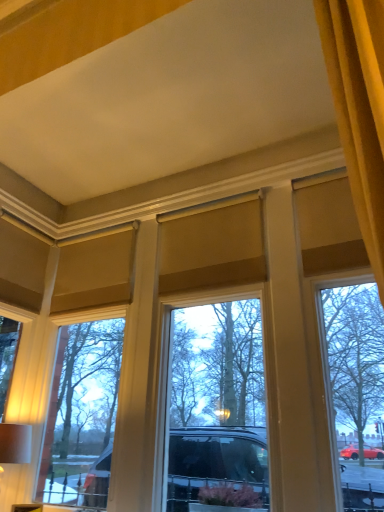
Question: From the image's perspective, is matte white table lamp at lower left located above or below matte glass window at center?

Choices:
 (A) below
 (B) above

Answer: (A)

Question: From a real-world perspective, is matte white table lamp at lower left above or below matte glass window at center?

Choices:
 (A) above
 (B) below

Answer: (B)

Question: In the image, is matte white table lamp at lower left positioned in front of or behind matte glass window at center?

Choices:
 (A) front
 (B) behind

Answer: (B)

Question: Is point (137, 250) closer or farther from the camera than point (14, 458)?

Choices:
 (A) closer
 (B) farther

Answer: (B)

Question: Would you say matte glass window at center is to the left or to the right of matte white table lamp at lower left in the picture?

Choices:
 (A) left
 (B) right

Answer: (B)

Question: Considering the positions of matte glass window at center and matte white table lamp at lower left in the image, is matte glass window at center wider or thinner than matte white table lamp at lower left?

Choices:
 (A) thin
 (B) wide

Answer: (A)

Question: Choose the correct answer: Is matte glass window at center inside matte white table lamp at lower left or outside it?

Choices:
 (A) outside
 (B) inside

Answer: (A)